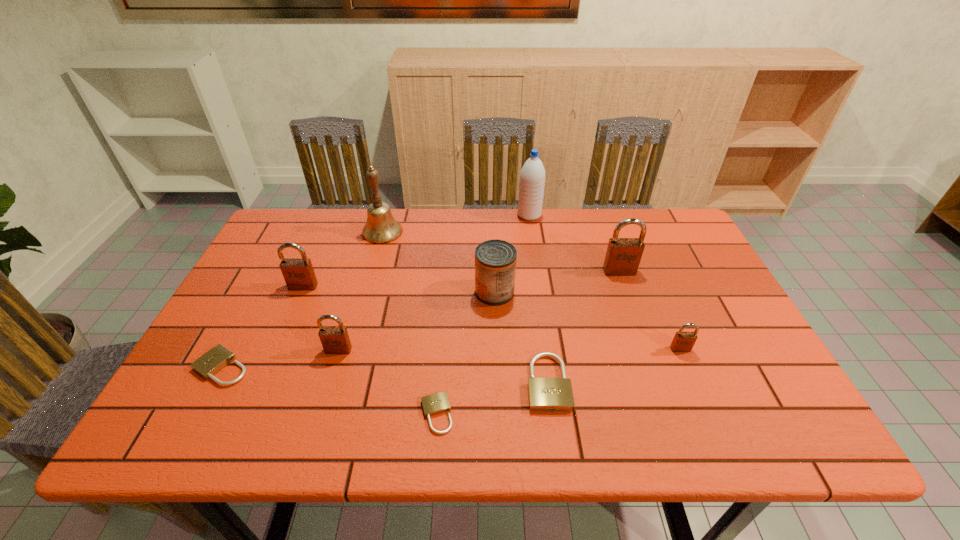
Find the location of `free space between the third nearest brown padlock and the third shortest padlock`. free space between the third nearest brown padlock and the third shortest padlock is located at coordinates (425, 334).

Locate an element on the screen. The image size is (960, 540). vacant region between the water bottle and the third brown padlock from right to left is located at coordinates click(434, 282).

Image resolution: width=960 pixels, height=540 pixels. In order to click on free spot between the sixth tallest object and the tallest padlock in this screenshot , I will do `click(479, 310)`.

Where is `the third closest object to the fourth padlock from right to left`? the third closest object to the fourth padlock from right to left is located at coordinates (495, 260).

At what (x,y) coordinates should I click in order to perform the action: click on object that is the eighth closest to the seventh tallest object. Please return your answer as a coordinate pair (x, y). The height and width of the screenshot is (540, 960). Looking at the image, I should click on (298, 273).

Select which padlock is the fifth closest to the water bottle. Please provide its 2D coordinates. Your answer should be formatted as a tuple, i.e. [(x, y)], where the tuple contains the x and y coordinates of a point satisfying the conditions above.

[(335, 340)]

Identify the location of the third closest padlock to the third shortest padlock. (623, 255).

Locate an element on the screen. The image size is (960, 540). brown padlock that is the third closest to the fourth padlock from right to left is located at coordinates (683, 341).

Image resolution: width=960 pixels, height=540 pixels. What are the coordinates of `brown padlock that is the second closest to the farthest brown padlock` in the screenshot? It's located at (335, 340).

Select which beige padlock is the third closest to the rightmost object. Please provide its 2D coordinates. Your answer should be formatted as a tuple, i.e. [(x, y)], where the tuple contains the x and y coordinates of a point satisfying the conditions above.

[(214, 360)]